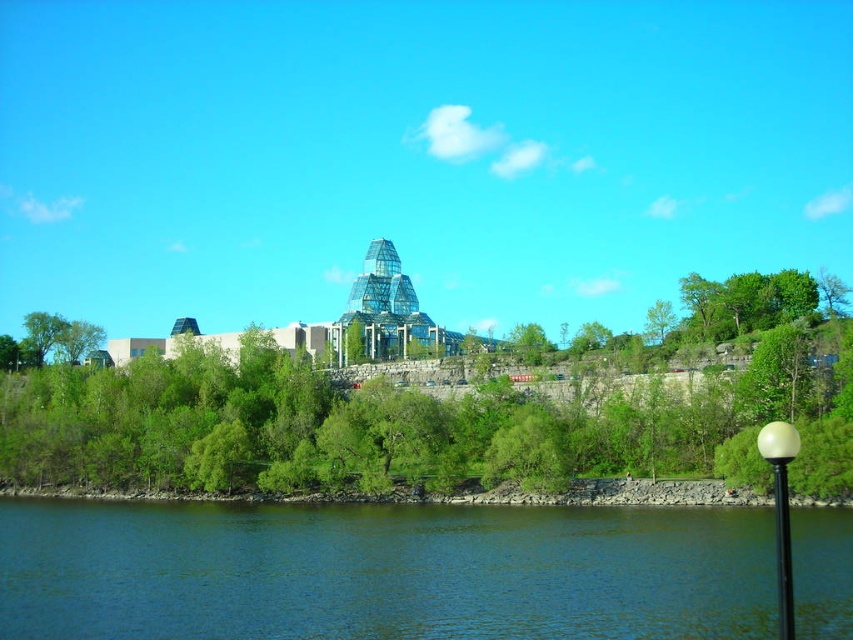
Based on the photo, can you confirm if blue water at lower center is thinner than white glossy lamp post at lower right?

Incorrect, blue water at lower center's width is not less than white glossy lamp post at lower right's.

Between blue water at lower center and white glossy lamp post at lower right, which one has more height?

Standing taller between the two is white glossy lamp post at lower right.

Is point (509, 544) closer to viewer compared to point (795, 444)?

No, it is behind (795, 444).

Find the location of a particular element. This screenshot has height=640, width=853. blue water at lower center is located at coordinates (383, 572).

Based on the photo, does green leafy tree at center have a larger size compared to white glossy lamp post at lower right?

Yes, green leafy tree at center is bigger than white glossy lamp post at lower right.

Identify the location of green leafy tree at center. The image size is (853, 640). (433, 416).

Which is behind, point (778, 378) or point (791, 435)?

Positioned behind is point (778, 378).

At what (x,y) coordinates should I click in order to perform the action: click on green leafy tree at center. Please return your answer as a coordinate pair (x, y). Looking at the image, I should click on (433, 416).

Can you confirm if green leafy tree at center is positioned above black glossy pole at lower right?

Yes.

Who is more distant from viewer, (334, 451) or (776, 540)?

Positioned behind is point (334, 451).

Where is `green leafy tree at center`? green leafy tree at center is located at coordinates (433, 416).